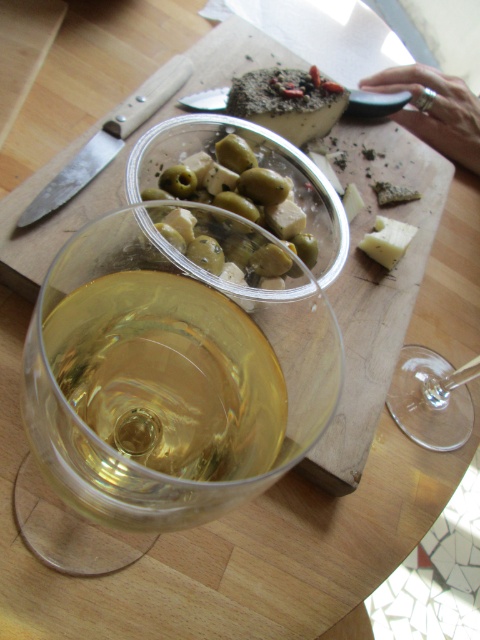
From the picture: You are holding a 12 inch ruler. You want to measure the distance from your current position to the point at coordinates point (454, 132). Can you reach it with your ruler?

The distance between point (454, 132) and the camera is 17.15 inches. Since the ruler is only 12 inches long, it is not long enough to reach the point.